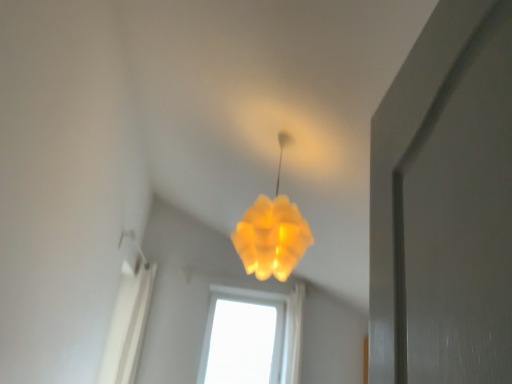
Question: From the image's perspective, is translucent yellow lampshade at center positioned above or below transparent glass window at center?

Choices:
 (A) below
 (B) above

Answer: (B)

Question: Does point (279, 258) appear closer or farther from the camera than point (233, 347)?

Choices:
 (A) closer
 (B) farther

Answer: (A)

Question: From a real-world perspective, is translucent yellow lampshade at center physically located above or below transparent glass window at center?

Choices:
 (A) above
 (B) below

Answer: (A)

Question: Considering the positions of transparent glass window at center and translucent yellow lampshade at center in the image, is transparent glass window at center wider or thinner than translucent yellow lampshade at center?

Choices:
 (A) wide
 (B) thin

Answer: (B)

Question: Considering the positions of transparent glass window at center and translucent yellow lampshade at center in the image, is transparent glass window at center taller or shorter than translucent yellow lampshade at center?

Choices:
 (A) short
 (B) tall

Answer: (B)

Question: Considering their positions, is transparent glass window at center located in front of or behind translucent yellow lampshade at center?

Choices:
 (A) front
 (B) behind

Answer: (B)

Question: Considering the positions of transparent glass window at center and translucent yellow lampshade at center in the image, is transparent glass window at center bigger or smaller than translucent yellow lampshade at center?

Choices:
 (A) small
 (B) big

Answer: (A)